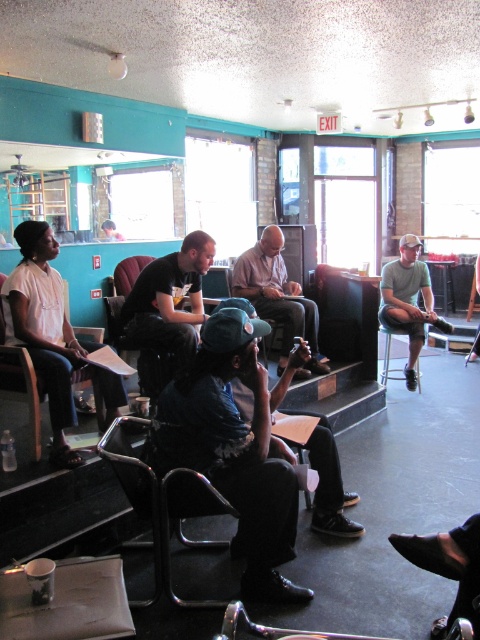
You are organizing a small event in this space and need to place a new table between the smooth brown leather jacket at center and the metallic stool at center. Which object should the table be placed closer to to ensure there is enough space?

The table should be placed closer to the metallic stool at center because the smooth brown leather jacket at center occupies less space, leaving more room near the metallic stool at center for the table.

You are organizing a small event in this space and need to place the smooth brown leather jacket at center and the metallic stool at center side by side. Which object should you place first to ensure they fit without overlapping?

The smooth brown leather jacket at center is wider than the metallic stool at center, so you should place the smooth brown leather jacket at center first to ensure there is enough space for both without overlapping.